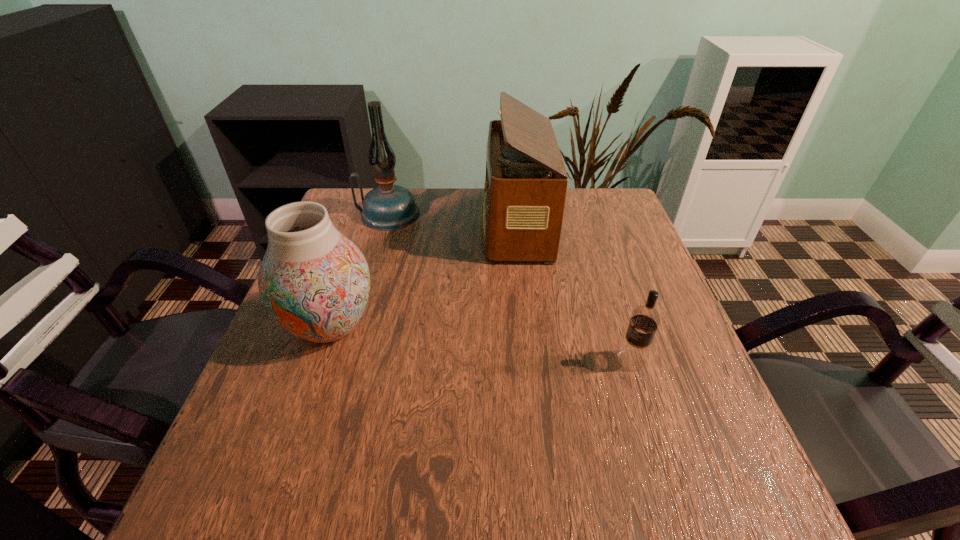
This screenshot has width=960, height=540. I want to click on the third object from left to right, so click(525, 187).

Where is `oil lamp`? oil lamp is located at coordinates (388, 207).

Locate an element on the screen. the third tallest object is located at coordinates (314, 281).

You are a GUI agent. You are given a task and a screenshot of the screen. Output one action in this format:
    pyautogui.click(x=<x>, y=<y>)
    Task: Click on the rightmost object
    
    Given the screenshot: What is the action you would take?
    pyautogui.click(x=633, y=354)

Find the location of a particular element. vodka is located at coordinates (633, 354).

Where is `vacant space situated on the front panel of the second object from right to left`? vacant space situated on the front panel of the second object from right to left is located at coordinates (352, 225).

The width and height of the screenshot is (960, 540). I want to click on vacant region located on the front panel of the second object from right to left, so click(x=359, y=225).

The width and height of the screenshot is (960, 540). I want to click on free location located 0.340m on the front panel of the second object from right to left, so click(x=359, y=225).

Identify the location of free region located 0.260m on the right of the oil lamp. (510, 214).

Where is `free location located on the right of the vase`? free location located on the right of the vase is located at coordinates (416, 325).